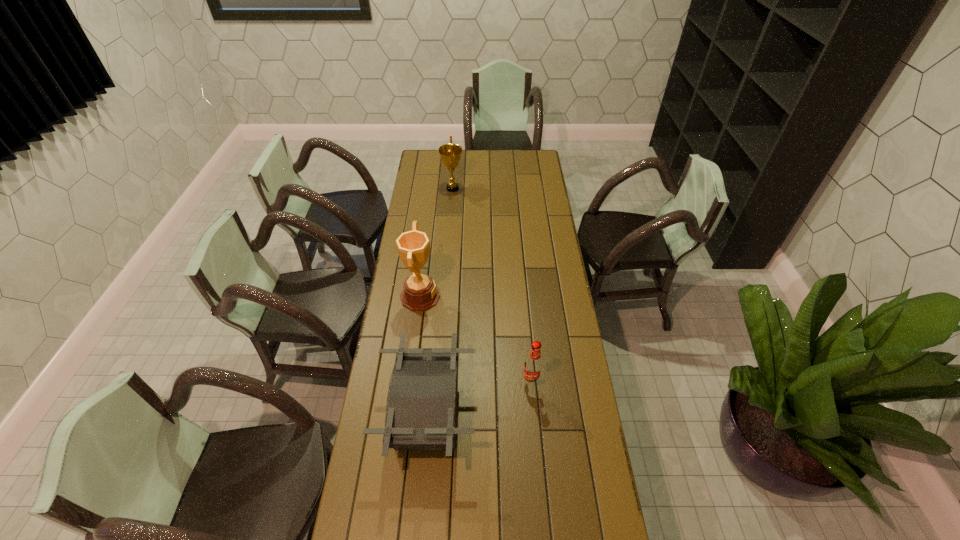
At what (x,y) coordinates should I click in order to perform the action: click on free space between the rightmost object and the nearer award. Please return your answer as a coordinate pair (x, y). The width and height of the screenshot is (960, 540). Looking at the image, I should click on (476, 339).

The width and height of the screenshot is (960, 540). I want to click on free space between the shortest object and the third shortest object, so click(x=441, y=302).

Find the location of a particular element. This screenshot has height=540, width=960. free space between the third shortest object and the rightmost object is located at coordinates (492, 285).

At what (x,y) coordinates should I click in order to perform the action: click on object that is the second closest to the drone. Please return your answer as a coordinate pair (x, y). Looking at the image, I should click on (420, 293).

I want to click on object that is the second closest to the drone, so click(420, 293).

Identify the location of free space in the image that satisfies the following two spatial constraints: 1. on the front-facing side of the root beer; 2. on the right side of the nearer award. The image size is (960, 540). (410, 382).

Locate an element on the screen. The image size is (960, 540). free space that satisfies the following two spatial constraints: 1. on the back side of the root beer; 2. on the front view with handles of the third shortest object is located at coordinates (514, 188).

Locate an element on the screen. This screenshot has width=960, height=540. vacant space that satisfies the following two spatial constraints: 1. on the back side of the third tallest object; 2. on the front-facing side of the third nearest object is located at coordinates (523, 296).

Identify the location of vacant area in the image that satisfies the following two spatial constraints: 1. on the front-facing side of the root beer; 2. on the right side of the nearer award. Image resolution: width=960 pixels, height=540 pixels. (410, 382).

I want to click on free spot that satisfies the following two spatial constraints: 1. on the front view with handles of the farthest object; 2. on the back side of the rightmost object, so click(x=438, y=382).